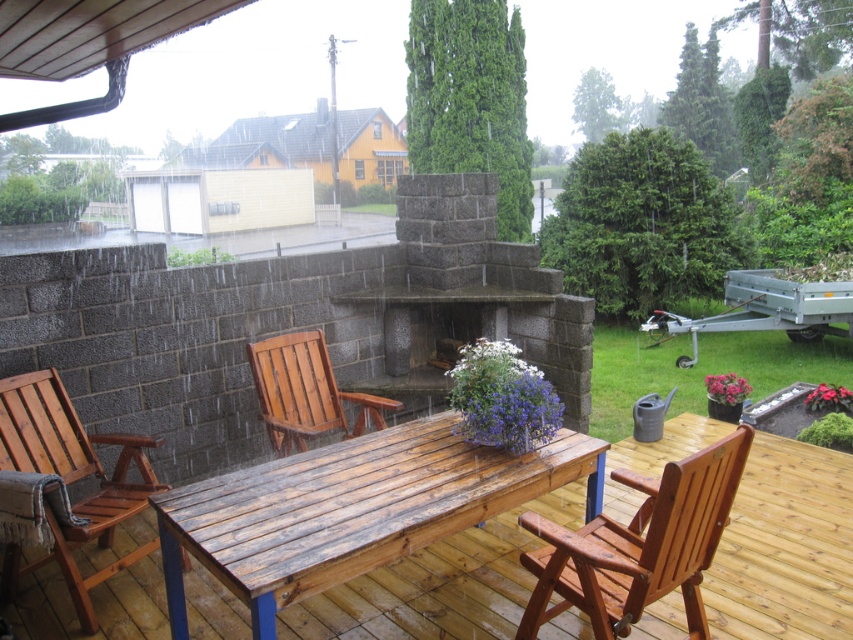
You are standing on the wooden deck and want to walk from the wooden table at center to the wooden chair at lower right. Which direction should you move to reach the chair?

You should move backward to reach the wooden chair at lower right because the wooden table at center is in front of it.